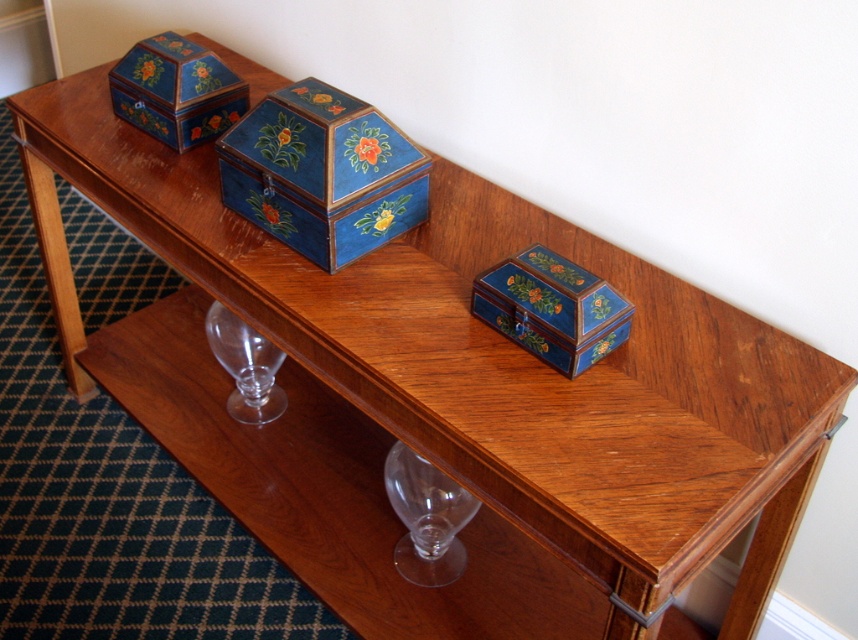
Question: Which object is positioned farthest from the transparent glass wine glass at lower left?

Choices:
 (A) transparent glass wine glass at lower center
 (B) matte blue wooden box at center

Answer: (B)

Question: Can you confirm if blue painted wood box at upper left is smaller than transparent glass wine glass at lower left?

Choices:
 (A) yes
 (B) no

Answer: (B)

Question: Is blue painted wood box at center below blue painted wood box at upper left?

Choices:
 (A) no
 (B) yes

Answer: (B)

Question: Which object is the closest to the matte blue wooden box at center?

Choices:
 (A) transparent glass wine glass at lower center
 (B) blue painted wood box at upper left
 (C) blue painted wood box at center

Answer: (C)

Question: Which is nearer to the blue painted wood box at center?

Choices:
 (A) transparent glass wine glass at lower left
 (B) matte blue wooden box at center
 (C) blue painted wood box at upper left
 (D) transparent glass wine glass at lower center

Answer: (B)

Question: Is blue painted wood box at center wider than matte blue wooden box at center?

Choices:
 (A) no
 (B) yes

Answer: (B)